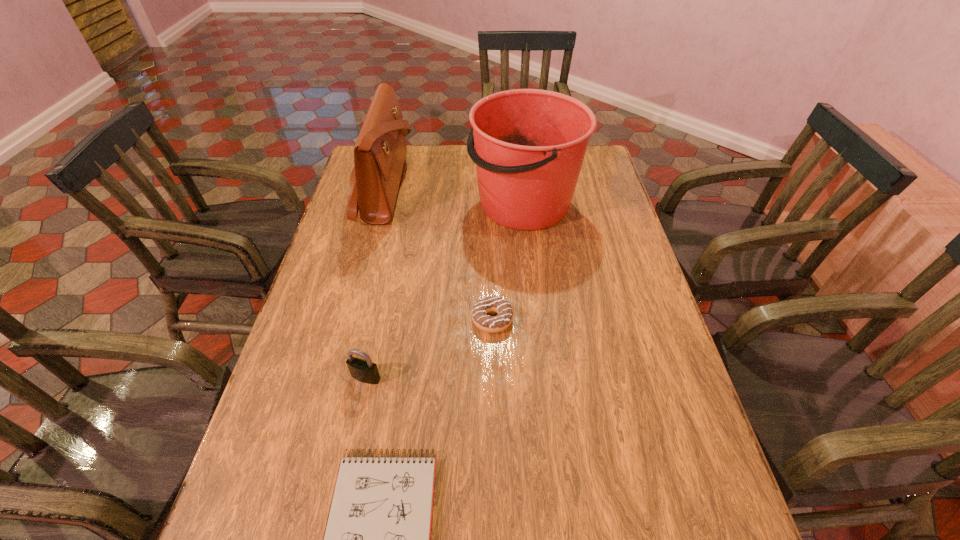
Where is `vacant point located between the satchel and the second nearest object`? This screenshot has height=540, width=960. vacant point located between the satchel and the second nearest object is located at coordinates (374, 282).

Find the location of a particular element. The image size is (960, 540). blank region between the bucket and the padlock is located at coordinates (444, 291).

Where is `free space that is in between the satchel and the bucket`? This screenshot has width=960, height=540. free space that is in between the satchel and the bucket is located at coordinates (454, 196).

Locate an element on the screen. the fourth closest object to the bucket is located at coordinates (377, 537).

Choose which object is the fourth nearest neighbor to the padlock. Please provide its 2D coordinates. Your answer should be formatted as a tuple, i.e. [(x, y)], where the tuple contains the x and y coordinates of a point satisfying the conditions above.

[(379, 154)]

The width and height of the screenshot is (960, 540). I want to click on free space that satisfies the following two spatial constraints: 1. on the back side of the padlock; 2. on the front flap of the satchel, so click(x=405, y=187).

Where is `blank space that satisfies the following two spatial constraints: 1. on the front flap of the second nearest object; 2. on the left side of the satchel`? blank space that satisfies the following two spatial constraints: 1. on the front flap of the second nearest object; 2. on the left side of the satchel is located at coordinates (334, 377).

At what (x,y) coordinates should I click in order to perform the action: click on vacant space that satisfies the following two spatial constraints: 1. on the front flap of the satchel; 2. on the left side of the bucket. Please return your answer as a coordinate pair (x, y). The width and height of the screenshot is (960, 540). Looking at the image, I should click on (379, 205).

What are the coordinates of `vacant space that satisfies the following two spatial constraints: 1. on the front flap of the fourth tallest object; 2. on the left side of the satchel` in the screenshot? It's located at (349, 319).

At what (x,y) coordinates should I click in order to perform the action: click on free space that satisfies the following two spatial constraints: 1. on the front flap of the bucket; 2. on the left side of the satchel. Please return your answer as a coordinate pair (x, y). Looking at the image, I should click on (379, 205).